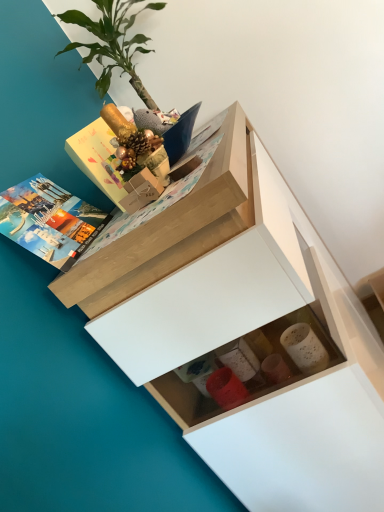
Locate an element on the screen. This screenshot has width=384, height=512. white matte chest of drawers at upper center is located at coordinates (240, 332).

This screenshot has height=512, width=384. I want to click on matte hardcover book at upper left, so click(49, 220).

Is green leafy plant at upper left at the back of white matte chest of drawers at upper center?

No, white matte chest of drawers at upper center is not facing away from green leafy plant at upper left.

Is white matte chest of drawers at upper center wider than green leafy plant at upper left?

Indeed, white matte chest of drawers at upper center has a greater width compared to green leafy plant at upper left.

Is white matte chest of drawers at upper center taller or shorter than green leafy plant at upper left?

white matte chest of drawers at upper center is taller than green leafy plant at upper left.

Considering the relative positions of white matte chest of drawers at upper center and green leafy plant at upper left in the image provided, is white matte chest of drawers at upper center to the right of green leafy plant at upper left from the viewer's perspective?

Correct, you'll find white matte chest of drawers at upper center to the right of green leafy plant at upper left.

From a real-world perspective, which is physically above, green leafy plant at upper left or matte hardcover book at upper left?

In real-world perspective, green leafy plant at upper left is above.

Can you confirm if green leafy plant at upper left is taller than matte hardcover book at upper left?

Correct, green leafy plant at upper left is much taller as matte hardcover book at upper left.

Can we say green leafy plant at upper left lies outside matte hardcover book at upper left?

Yes, green leafy plant at upper left is not within matte hardcover book at upper left.

From the image's perspective, would you say green leafy plant at upper left is positioned over white matte chest of drawers at upper center?

Yes, from the image's perspective, green leafy plant at upper left is over white matte chest of drawers at upper center.

In the scene shown: Does green leafy plant at upper left turn towards white matte chest of drawers at upper center?

No, green leafy plant at upper left is not aimed at white matte chest of drawers at upper center.

From a real-world perspective, is green leafy plant at upper left on white matte chest of drawers at upper center?

Yes, from a real-world perspective, green leafy plant at upper left is above white matte chest of drawers at upper center.

Is green leafy plant at upper left in contact with white matte chest of drawers at upper center?

green leafy plant at upper left is not next to white matte chest of drawers at upper center, and they're not touching.

Does point (96, 223) come farther from viewer compared to point (304, 426)?

Yes.

Is matte hardcover book at upper left located outside white matte chest of drawers at upper center?

Yes, matte hardcover book at upper left is not within white matte chest of drawers at upper center.

Is matte hardcover book at upper left further to camera compared to white matte chest of drawers at upper center?

Yes, it is.

Is white matte chest of drawers at upper center positioned behind matte hardcover book at upper left?

No, it is in front of matte hardcover book at upper left.

How distant is white matte chest of drawers at upper center from matte hardcover book at upper left?

14.18 inches.

From a real-world perspective, is white matte chest of drawers at upper center beneath matte hardcover book at upper left?

Correct, in the physical world, white matte chest of drawers at upper center is lower than matte hardcover book at upper left.

Which is nearer, [262,434] or [14,214]?

The point [14,214] is closer to the camera.

Based on their sizes in the image, would you say matte hardcover book at upper left is bigger or smaller than green leafy plant at upper left?

matte hardcover book at upper left is smaller than green leafy plant at upper left.

Is matte hardcover book at upper left positioned with its back to green leafy plant at upper left?

No, matte hardcover book at upper left's orientation is not away from green leafy plant at upper left.

Considering the sizes of objects matte hardcover book at upper left and green leafy plant at upper left in the image provided, who is taller, matte hardcover book at upper left or green leafy plant at upper left?

green leafy plant at upper left is taller.

Can you tell me how much matte hardcover book at upper left and green leafy plant at upper left differ in facing direction?

matte hardcover book at upper left and green leafy plant at upper left are facing 1.91 degrees away from each other.

The image size is (384, 512). I want to click on the chest of drawers that appears below the green leafy plant at upper left (from a real-world perspective), so click(x=240, y=332).

At what (x,y) coordinates should I click in order to perform the action: click on houseplant that appears behind the matte hardcover book at upper left. Please return your answer as a coordinate pair (x, y). The image size is (384, 512). Looking at the image, I should click on (113, 42).

Which object lies further to the anchor point white matte chest of drawers at upper center, green leafy plant at upper left or matte hardcover book at upper left?

green leafy plant at upper left is positioned further to the anchor white matte chest of drawers at upper center.

From the image, which object appears to be nearer to green leafy plant at upper left, white matte chest of drawers at upper center or matte hardcover book at upper left?

The object closer to green leafy plant at upper left is matte hardcover book at upper left.

Estimate the real-world distances between objects in this image. Which object is further from green leafy plant at upper left, matte hardcover book at upper left or white matte chest of drawers at upper center?

The object further to green leafy plant at upper left is white matte chest of drawers at upper center.

Which object lies nearer to the anchor point matte hardcover book at upper left, green leafy plant at upper left or white matte chest of drawers at upper center?

Based on the image, white matte chest of drawers at upper center appears to be nearer to matte hardcover book at upper left.

Estimate the real-world distances between objects in this image. Which object is further from matte hardcover book at upper left, white matte chest of drawers at upper center or green leafy plant at upper left?

The object further to matte hardcover book at upper left is green leafy plant at upper left.

Based on the photo, based on their spatial positions, is matte hardcover book at upper left or green leafy plant at upper left further from white matte chest of drawers at upper center?

green leafy plant at upper left.

Locate an element on the screen. The image size is (384, 512). book that lies between green leafy plant at upper left and white matte chest of drawers at upper center from top to bottom is located at coordinates (x=49, y=220).